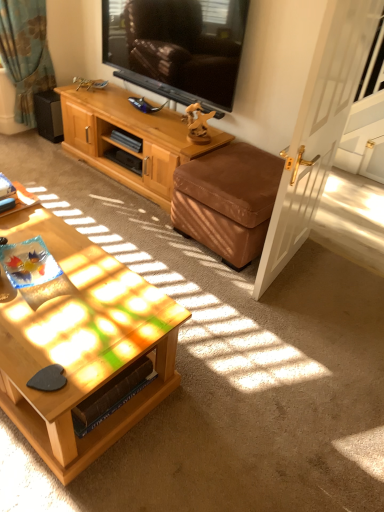
Find the location of a particular element. vacant area that is in front of brown leather ottoman at lower right is located at coordinates (243, 294).